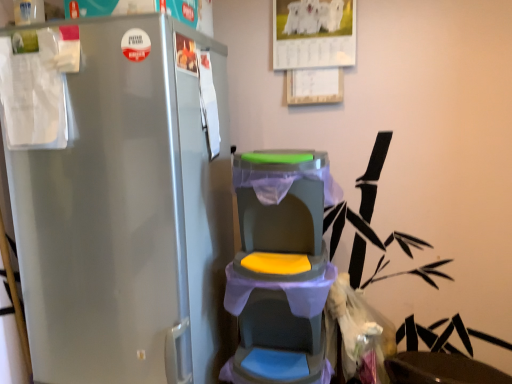
Where is `matte black swivel chair at lower right`? The height and width of the screenshot is (384, 512). matte black swivel chair at lower right is located at coordinates (441, 369).

Describe the element at coordinates (441, 369) in the screenshot. This screenshot has height=384, width=512. I see `matte black swivel chair at lower right` at that location.

Identify the location of matte plastic baby carriage at center. (280, 267).

Describe the element at coordinates (280, 267) in the screenshot. I see `matte plastic baby carriage at center` at that location.

Locate an element on the screen. Image resolution: width=512 pixels, height=384 pixels. matte black swivel chair at lower right is located at coordinates (441, 369).

Considering the relative positions of matte plastic baby carriage at center and matte black swivel chair at lower right in the image provided, is matte plastic baby carriage at center to the right of matte black swivel chair at lower right from the viewer's perspective?

In fact, matte plastic baby carriage at center is to the left of matte black swivel chair at lower right.

Is matte plastic baby carriage at center closer to the viewer compared to matte black swivel chair at lower right?

Yes, it is.

Between point (321, 263) and point (470, 383), which one is positioned behind?

The point (470, 383) is farther.

From the image's perspective, between matte plastic baby carriage at center and matte black swivel chair at lower right, who is located below?

From the image's view, matte black swivel chair at lower right is below.

Based on the photo, from a real-world perspective, who is located lower, matte plastic baby carriage at center or matte black swivel chair at lower right?

In real-world perspective, matte black swivel chair at lower right is lower.

In the scene shown: Is matte plastic baby carriage at center wider or thinner than matte black swivel chair at lower right?

In the image, matte plastic baby carriage at center appears to be more narrow than matte black swivel chair at lower right.

Considering the relative sizes of matte plastic baby carriage at center and matte black swivel chair at lower right in the image provided, is matte plastic baby carriage at center taller than matte black swivel chair at lower right?

Yes.

Is matte plastic baby carriage at center bigger than matte black swivel chair at lower right?

Actually, matte plastic baby carriage at center might be smaller than matte black swivel chair at lower right.

Is matte plastic baby carriage at center completely or partially outside of matte black swivel chair at lower right?

Yes.

Are matte plastic baby carriage at center and matte black swivel chair at lower right far apart?

Actually, matte plastic baby carriage at center and matte black swivel chair at lower right are a little close together.

Is matte plastic baby carriage at center looking in the opposite direction of matte black swivel chair at lower right?

No, matte plastic baby carriage at center is not facing away from matte black swivel chair at lower right.

Where is `swivel chair behind the matte plastic baby carriage at center`? The height and width of the screenshot is (384, 512). swivel chair behind the matte plastic baby carriage at center is located at coordinates (441, 369).

Which object is positioned more to the left, matte black swivel chair at lower right or matte plastic baby carriage at center?

matte plastic baby carriage at center.

Considering the positions of objects matte black swivel chair at lower right and matte plastic baby carriage at center in the image provided, who is in front, matte black swivel chair at lower right or matte plastic baby carriage at center?

Positioned in front is matte plastic baby carriage at center.

Considering the points (479, 374) and (320, 240), which point is in front, point (479, 374) or point (320, 240)?

The point (320, 240) is more forward.

From the image's perspective, would you say matte black swivel chair at lower right is shown under matte plastic baby carriage at center?

Indeed, from the image's perspective, matte black swivel chair at lower right is shown beneath matte plastic baby carriage at center.

From a real-world perspective, is matte black swivel chair at lower right over matte plastic baby carriage at center?

Incorrect, from a real-world perspective, matte black swivel chair at lower right is lower than matte plastic baby carriage at center.

Considering the relative sizes of matte black swivel chair at lower right and matte plastic baby carriage at center in the image provided, is matte black swivel chair at lower right wider than matte plastic baby carriage at center?

Indeed, matte black swivel chair at lower right has a greater width compared to matte plastic baby carriage at center.

Considering the relative sizes of matte black swivel chair at lower right and matte plastic baby carriage at center in the image provided, is matte black swivel chair at lower right taller than matte plastic baby carriage at center?

In fact, matte black swivel chair at lower right may be shorter than matte plastic baby carriage at center.

Considering the sizes of matte black swivel chair at lower right and matte plastic baby carriage at center in the image, is matte black swivel chair at lower right bigger or smaller than matte plastic baby carriage at center?

Considering their sizes, matte black swivel chair at lower right takes up more space than matte plastic baby carriage at center.

Would you say matte plastic baby carriage at center is part of matte black swivel chair at lower right's contents?

→ No, matte black swivel chair at lower right does not contain matte plastic baby carriage at center.

Is there a large distance between matte black swivel chair at lower right and matte plastic baby carriage at center?

matte black swivel chair at lower right is near matte plastic baby carriage at center, not far away.

Is matte black swivel chair at lower right oriented away from matte plastic baby carriage at center?

matte black swivel chair at lower right is not turned away from matte plastic baby carriage at center.

What's the angular difference between matte black swivel chair at lower right and matte plastic baby carriage at center's facing directions?

The angular difference between matte black swivel chair at lower right and matte plastic baby carriage at center is 2.23 degrees.

Image resolution: width=512 pixels, height=384 pixels. Find the location of `baby carriage above the matte black swivel chair at lower right (from a real-world perspective)`. baby carriage above the matte black swivel chair at lower right (from a real-world perspective) is located at coordinates (280, 267).

Find the location of `swivel chair that appears below the matte plastic baby carriage at center (from a real-world perspective)`. swivel chair that appears below the matte plastic baby carriage at center (from a real-world perspective) is located at coordinates (441, 369).

Find the location of a particular element. This screenshot has height=384, width=512. baby carriage above the matte black swivel chair at lower right (from a real-world perspective) is located at coordinates (280, 267).